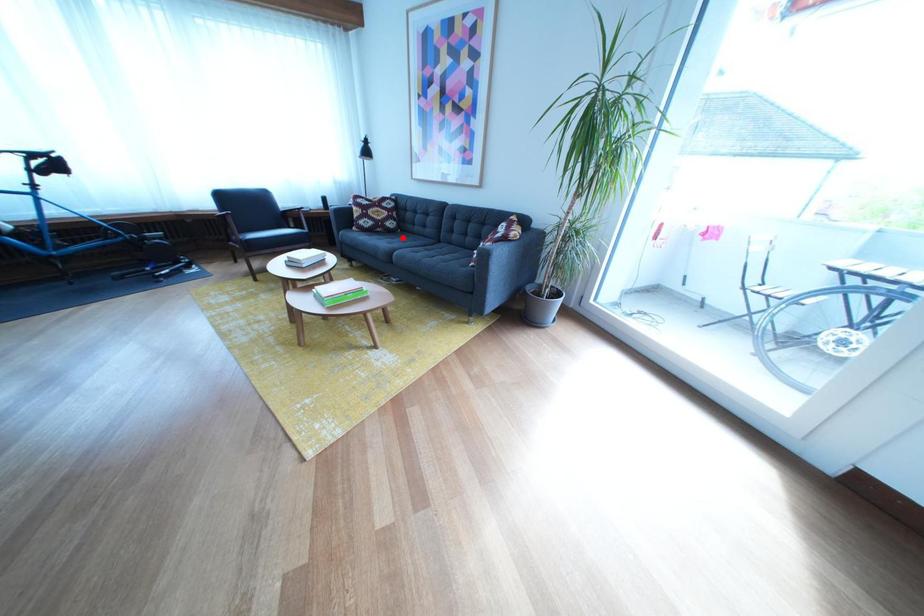
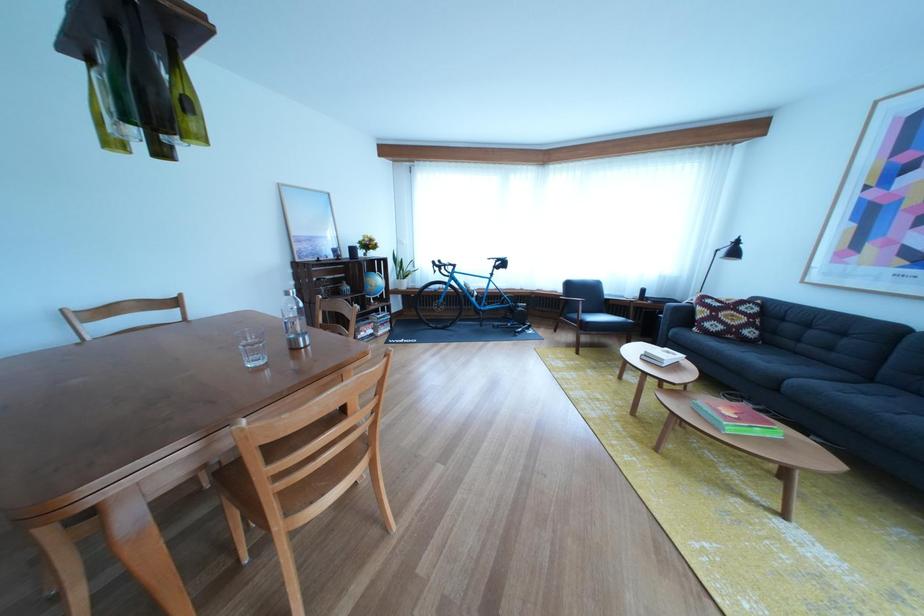
The point at the highlighted location is marked in the first image. Where is the corresponding point in the second image?

(758, 347)